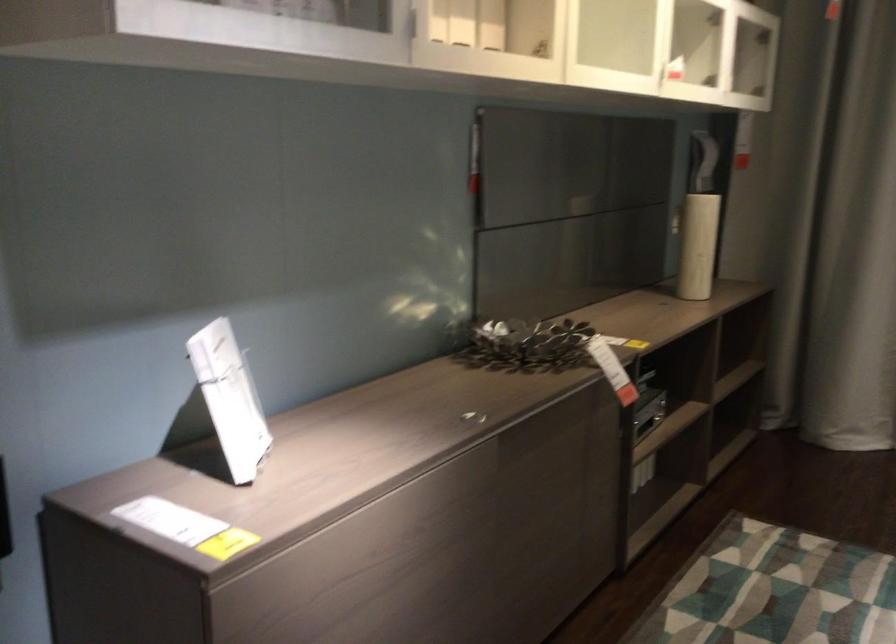
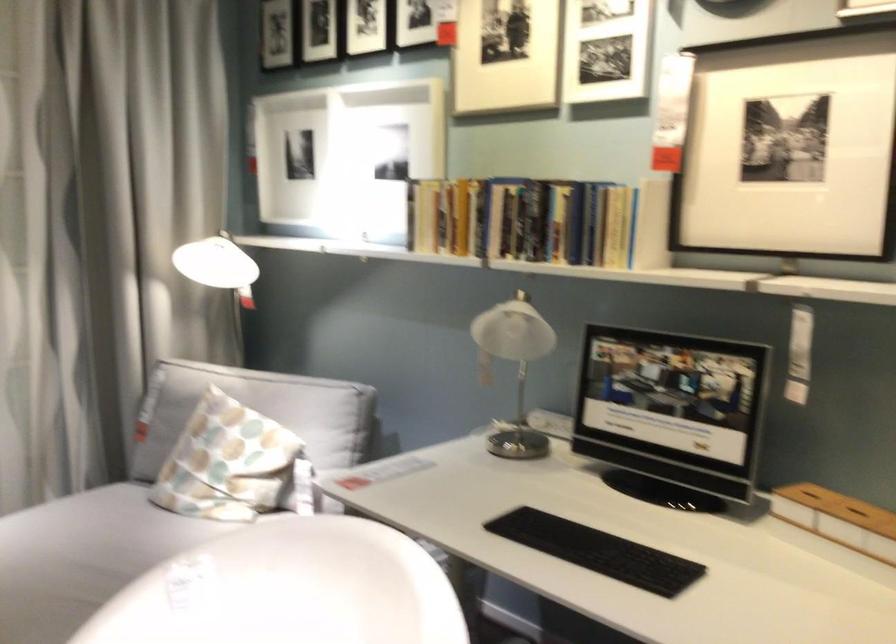
Question: The first image is from the beginning of the video and the second image is from the end. How did the camera likely rotate when shooting the video?

Choices:
 (A) Left
 (B) Right
 (C) Up
 (D) Down

Answer: (B)